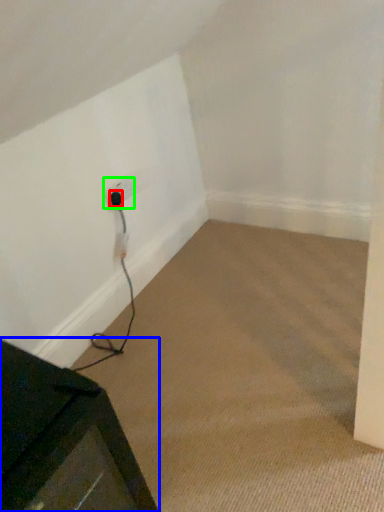
Question: Considering the real-world distances, which object is closest to plug (highlighted by a red box)? furniture (highlighted by a blue box) or electric outlet (highlighted by a green box).

Choices:
 (A) furniture
 (B) electric outlet

Answer: (B)